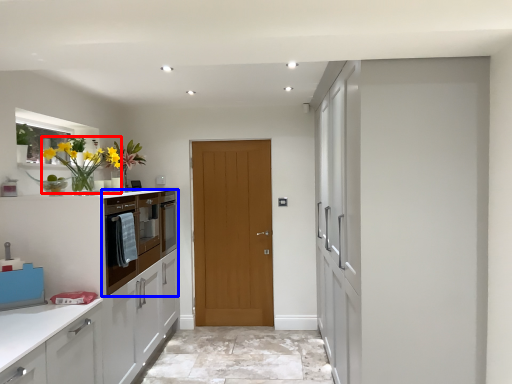
Question: Which object is further to the camera taking this photo, floral arrangement (highlighted by a red box) or cabinetry (highlighted by a blue box)?

Choices:
 (A) floral arrangement
 (B) cabinetry

Answer: (B)